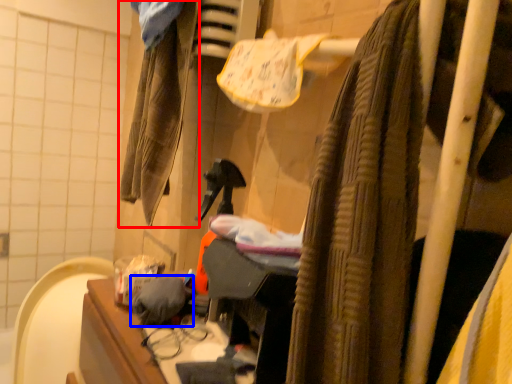
Question: Which object is closer to the camera taking this photo, clothing (highlighted by a red box) or clothing (highlighted by a blue box)?

Choices:
 (A) clothing
 (B) clothing

Answer: (B)